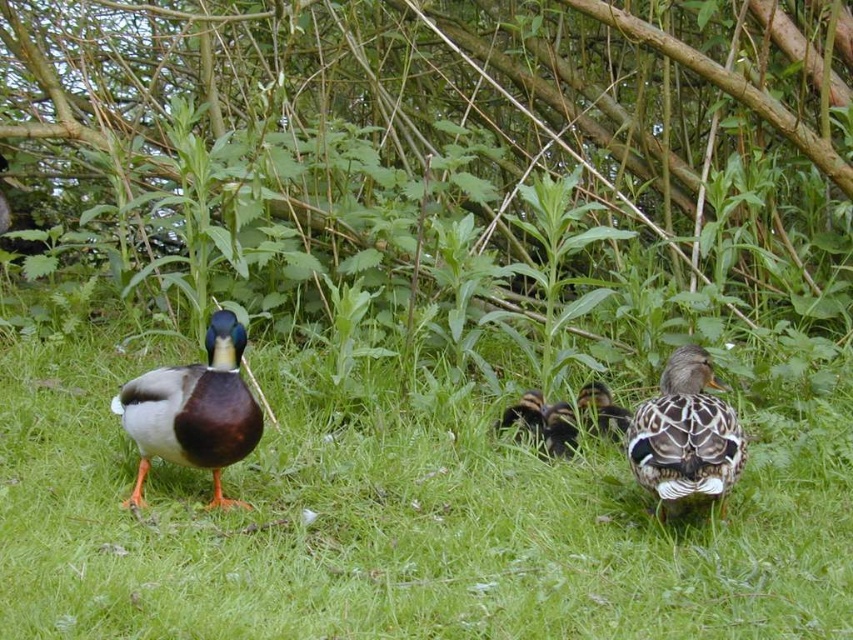
Question: Which object is farther from the camera taking this photo?

Choices:
 (A) speckled brown duckling at center
 (B) speckled feathered duck at right

Answer: (A)

Question: Does shiny brown duck at left appear under speckled feathered duck at right?

Choices:
 (A) yes
 (B) no

Answer: (B)

Question: Is speckled feathered duck at right behind speckled brown duckling at center?

Choices:
 (A) no
 (B) yes

Answer: (A)

Question: Which point is farther to the camera?

Choices:
 (A) (693, 438)
 (B) (598, 420)
 (C) (190, 401)

Answer: (B)

Question: Is speckled feathered duck at right bigger than speckled brown duckling at center?

Choices:
 (A) no
 (B) yes

Answer: (B)

Question: Among these objects, which one is nearest to the camera?

Choices:
 (A) speckled feathered duck at right
 (B) speckled brown duckling at center
 (C) shiny brown duck at left

Answer: (C)